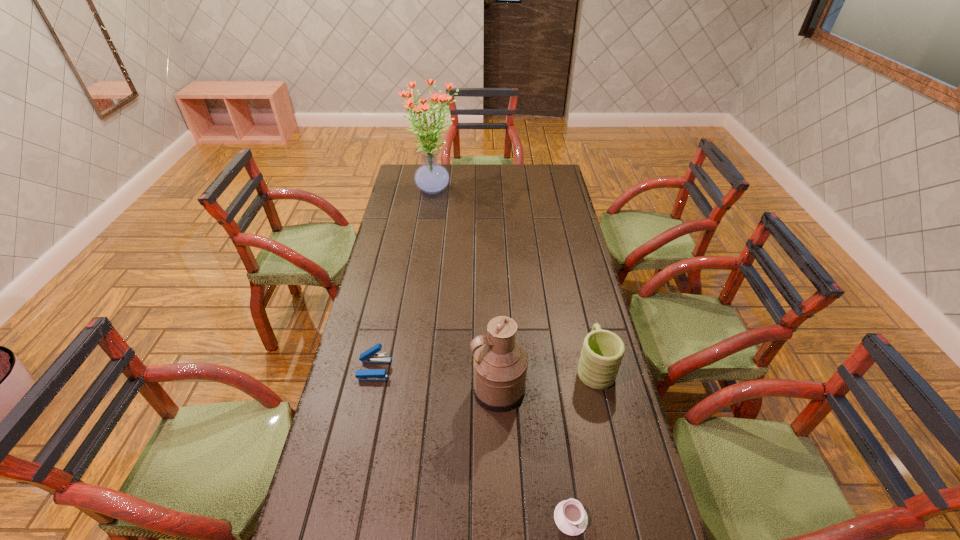
Locate an element on the screen. flower arrangement is located at coordinates (431, 177).

The image size is (960, 540). What are the coordinates of `the farthest object` in the screenshot? It's located at (431, 177).

What are the coordinates of `the second tallest object` in the screenshot? It's located at (500, 364).

Locate an element on the screen. This screenshot has width=960, height=540. the third object from right to left is located at coordinates (500, 364).

The image size is (960, 540). What are the coordinates of `mug` in the screenshot? It's located at (602, 352).

At what (x,y) coordinates should I click in order to perform the action: click on the third shortest object. Please return your answer as a coordinate pair (x, y). The height and width of the screenshot is (540, 960). Looking at the image, I should click on (602, 352).

Where is `stapler`? This screenshot has width=960, height=540. stapler is located at coordinates (369, 356).

At what (x,y) coordinates should I click in order to perform the action: click on the second object from right to left. Please return your answer as a coordinate pair (x, y). Image resolution: width=960 pixels, height=540 pixels. Looking at the image, I should click on (570, 517).

Where is `the shortest object`? the shortest object is located at coordinates (570, 517).

Where is `vacant region located on the front of the flower arrangement`? This screenshot has width=960, height=540. vacant region located on the front of the flower arrangement is located at coordinates 430,226.